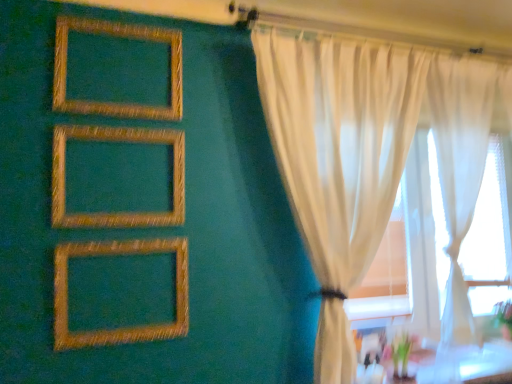
Question: Is gold textured frame at center, which ranks as the second picture frame in bottom-to-top order, spatially inside sheer white curtains at right, or outside of it?

Choices:
 (A) outside
 (B) inside

Answer: (A)

Question: Would you say gold textured frame at center, which ranks as the second picture frame in bottom-to-top order, is to the left or to the right of sheer white curtains at right in the picture?

Choices:
 (A) left
 (B) right

Answer: (A)

Question: Considering the real-world distances, which object is closest to the gold textured frame at center, which ranks as the second picture frame in bottom-to-top order?

Choices:
 (A) gold textured frame at upper left, the 1th picture frame viewed from the top
 (B) white sheer curtain at right
 (C) gold textured picture frame at lower left, which is counted as the third picture frame, starting from the top
 (D) sheer white curtains at right

Answer: (C)

Question: Which is nearer to the gold textured picture frame at lower left, placed as the first picture frame when sorted from bottom to top?

Choices:
 (A) white sheer curtain at right
 (B) gold textured frame at upper left, acting as the 3th picture frame starting from the bottom
 (C) sheer white curtains at right
 (D) gold textured frame at center, placed as the second picture frame when sorted from top to bottom

Answer: (D)